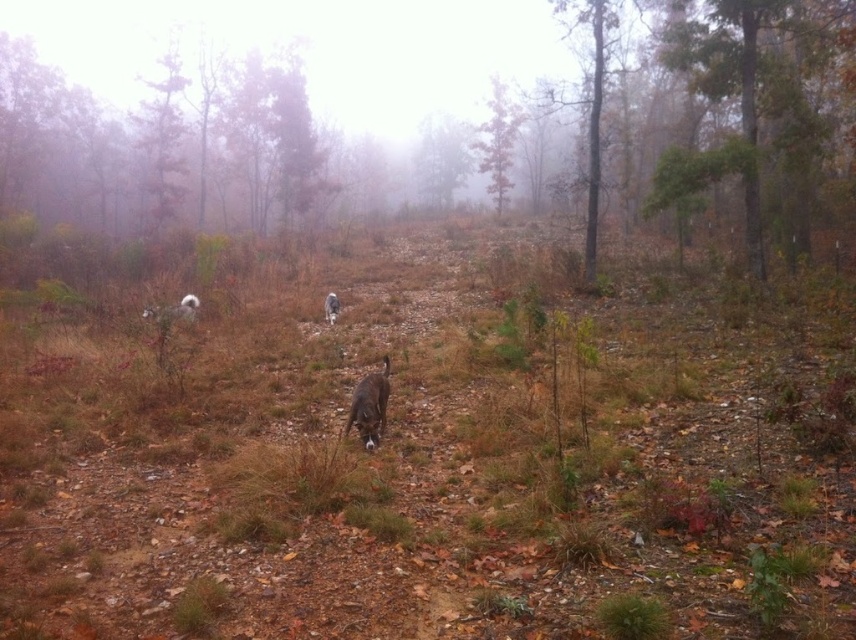
You are a photographer trying to capture a shot of the white fur dog at center and the green textured tree at right. Based on their sizes in the image, which one would appear larger in your photo?

The green textured tree at right is taller than the white fur dog at center, so it would appear larger in the photo.

You are a photographer standing at the camera position. You want to take a photo of the smooth brown tree trunk at upper left. However, there are three dogs in the scene. The nearest dog is 5 meters away from you. Can you capture the tree trunk in your photo without the dogs blocking it?

The smooth brown tree trunk at upper left is 26.36 meters from the camera, which is much farther than the nearest dog at 5 meters. Since the dogs are closer, they may block the view of the tree trunk unless you move or reposition yourself to avoid them.

You are a hiker trying to navigate through the misty forest. You see the smooth brown tree trunk at upper left and the green matte tree at upper left. Which tree is positioned more to the right side of the image?

The smooth brown tree trunk at upper left is positioned more to the right side of the image compared to the green matte tree at upper left.